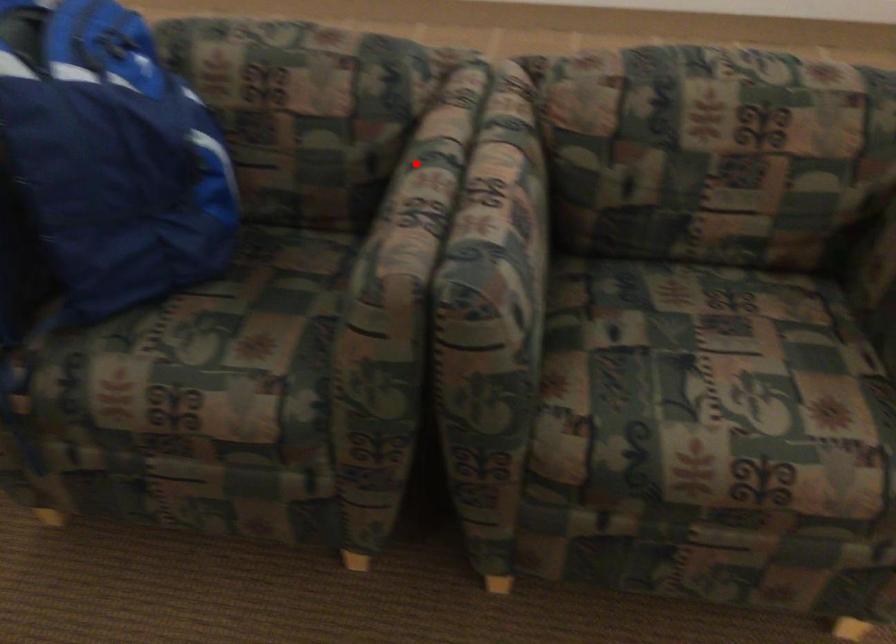
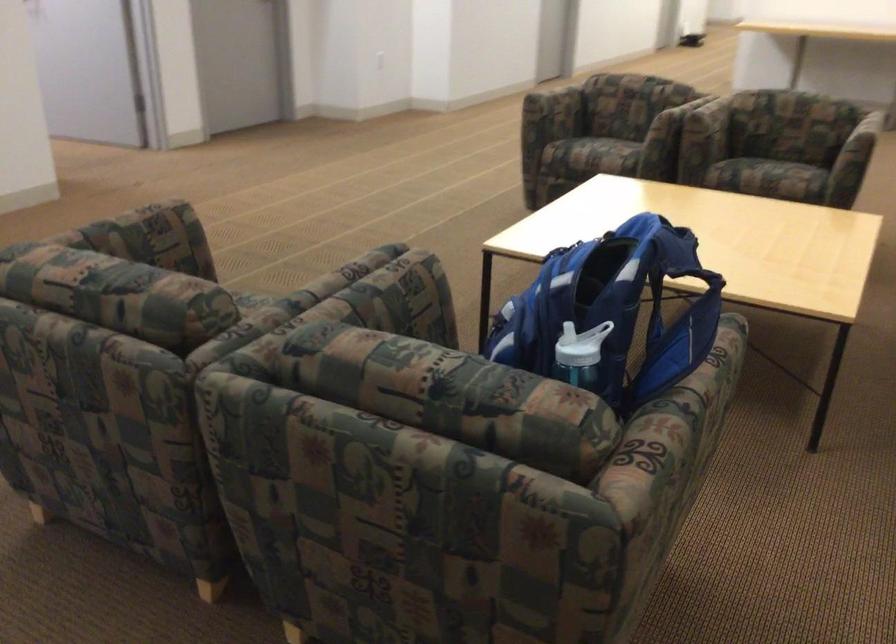
Question: I am providing you with two images of the same scene from different viewpoints. Image1 has a red point marked. In image2, the corresponding 3D location appears at what relative position? Reply with the corresponding letter.

Choices:
 (A) Closer
 (B) Farther

Answer: (B)